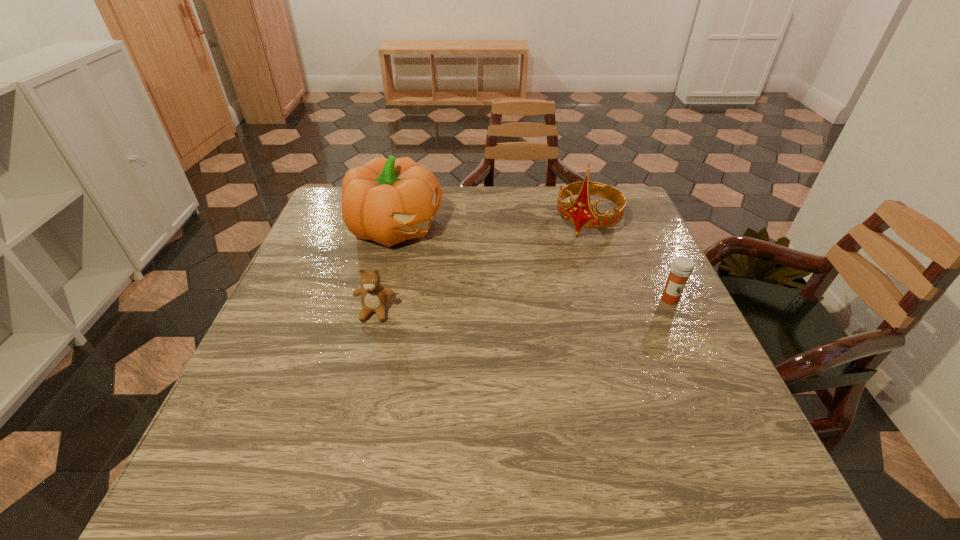
Identify the location of teddy bear. The width and height of the screenshot is (960, 540). (374, 296).

Locate an element on the screen. Image resolution: width=960 pixels, height=540 pixels. medicine is located at coordinates (681, 268).

You are a GUI agent. You are given a task and a screenshot of the screen. Output one action in this format:
    pyautogui.click(x=<x>, y=<y>)
    Task: Click on the pumpkin
    This screenshot has height=540, width=960.
    Given the screenshot: What is the action you would take?
    pyautogui.click(x=391, y=200)

I want to click on the second object from right to left, so click(580, 213).

Locate an element on the screen. vacant point located 0.050m on the front-facing side of the teddy bear is located at coordinates 368,341.

You are a GUI agent. You are given a task and a screenshot of the screen. Output one action in this format:
    pyautogui.click(x=<x>, y=<y>)
    Task: Click on the free space located on the label side of the rightmost object
    The image size is (960, 540).
    Given the screenshot: What is the action you would take?
    pyautogui.click(x=731, y=429)

You are a GUI agent. You are given a task and a screenshot of the screen. Output one action in this format:
    pyautogui.click(x=<x>, y=<y>)
    Task: Click on the blank area located on the carved face of the pumpkin
    The height and width of the screenshot is (540, 960).
    Given the screenshot: What is the action you would take?
    pyautogui.click(x=466, y=262)

At what (x,y) coordinates should I click in order to perform the action: click on blank space located 0.390m on the carved face of the pumpkin. Please return your answer as a coordinate pair (x, y). This screenshot has width=960, height=540. Looking at the image, I should click on (557, 307).

The height and width of the screenshot is (540, 960). I want to click on free space located on the carved face of the pumpkin, so click(553, 305).

I want to click on vacant area situated on the front-facing side of the third object from left to right, so click(538, 298).